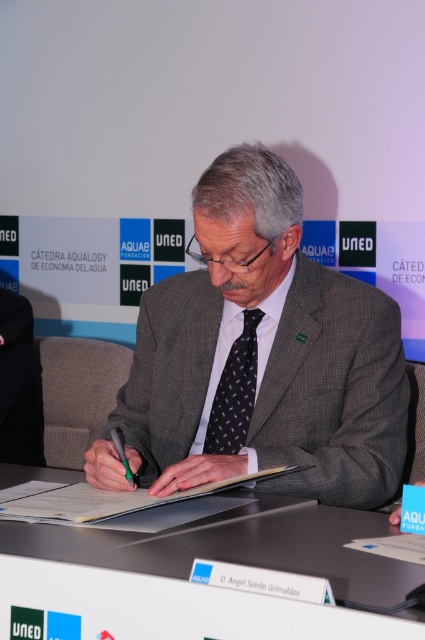
Looking at this image, you are standing in front of the man at the table. Which object is closer to you, the white plastic table at center or the black dotted tie at center?

The white plastic table at center is closer to the viewer than the black dotted tie at center.

You are a photographer taking a picture of the man at the table. You need to place a small accent light at point (235,563). Where exactly on the table should you place the light?

Place the light at point (235,563) on the white plastic table at center.